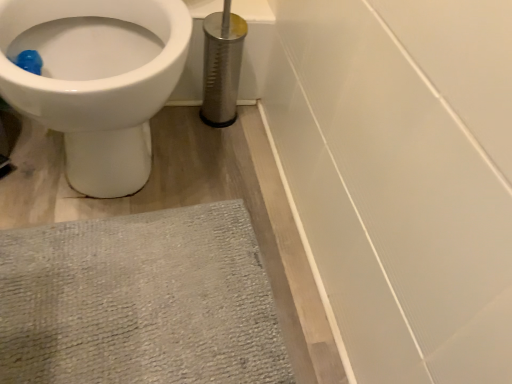
Question: Should I look upward or downward to see white glossy toilet at upper left?

Choices:
 (A) up
 (B) down

Answer: (A)

Question: Does white glossy toilet at upper left appear on the left side of gray textured bath mat at lower left?

Choices:
 (A) yes
 (B) no

Answer: (A)

Question: Is white glossy toilet at upper left positioned with its back to gray textured bath mat at lower left?

Choices:
 (A) yes
 (B) no

Answer: (B)

Question: Can gray textured bath mat at lower left be found inside white glossy toilet at upper left?

Choices:
 (A) no
 (B) yes

Answer: (A)

Question: From the image's perspective, would you say white glossy toilet at upper left is shown under gray textured bath mat at lower left?

Choices:
 (A) no
 (B) yes

Answer: (A)

Question: Is white glossy toilet at upper left further to camera compared to gray textured bath mat at lower left?

Choices:
 (A) yes
 (B) no

Answer: (B)

Question: From a real-world perspective, is white glossy toilet at upper left over gray textured bath mat at lower left?

Choices:
 (A) no
 (B) yes

Answer: (B)

Question: Considering the relative sizes of gray textured bath mat at lower left and white glossy toilet at upper left in the image provided, is gray textured bath mat at lower left taller than white glossy toilet at upper left?

Choices:
 (A) no
 (B) yes

Answer: (A)

Question: Is gray textured bath mat at lower left positioned behind white glossy toilet at upper left?

Choices:
 (A) yes
 (B) no

Answer: (A)

Question: Is gray textured bath mat at lower left facing towards white glossy toilet at upper left?

Choices:
 (A) yes
 (B) no

Answer: (B)

Question: Is gray textured bath mat at lower left outside of white glossy toilet at upper left?

Choices:
 (A) yes
 (B) no

Answer: (A)

Question: Does gray textured bath mat at lower left appear on the right side of white glossy toilet at upper left?

Choices:
 (A) no
 (B) yes

Answer: (B)

Question: From the image's perspective, does gray textured bath mat at lower left appear lower than white glossy toilet at upper left?

Choices:
 (A) yes
 (B) no

Answer: (A)

Question: Is gray textured bath mat at lower left wider or thinner than white glossy toilet at upper left?

Choices:
 (A) thin
 (B) wide

Answer: (A)